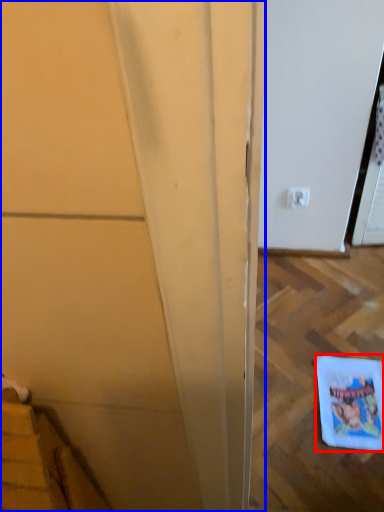
Question: Which object is further to the camera taking this photo, comic book (highlighted by a red box) or door (highlighted by a blue box)?

Choices:
 (A) comic book
 (B) door

Answer: (A)